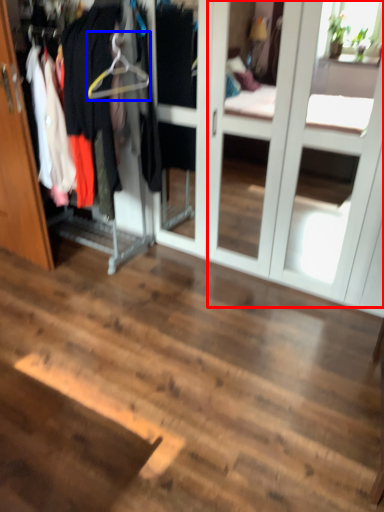
Question: Which object appears farthest to the camera in this image, screen door (highlighted by a red box) or hanger (highlighted by a blue box)?

Choices:
 (A) screen door
 (B) hanger

Answer: (B)